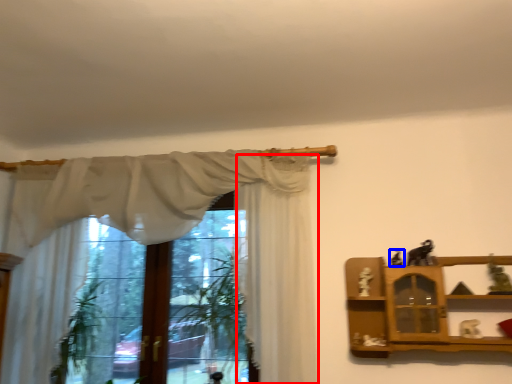
Question: Which object is closer to the camera taking this photo, curtain (highlighted by a red box) or toy (highlighted by a blue box)?

Choices:
 (A) curtain
 (B) toy

Answer: (A)